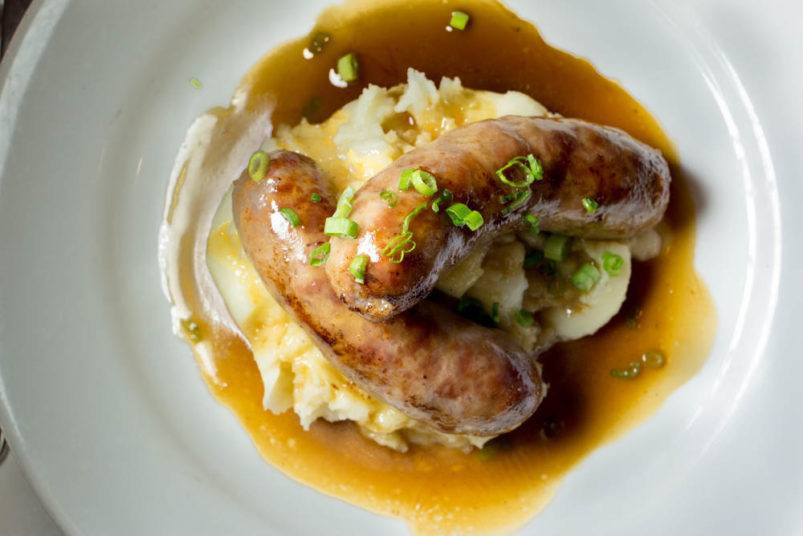
In order to click on plate in this screenshot , I will do `click(84, 330)`, `click(699, 64)`, `click(752, 456)`.